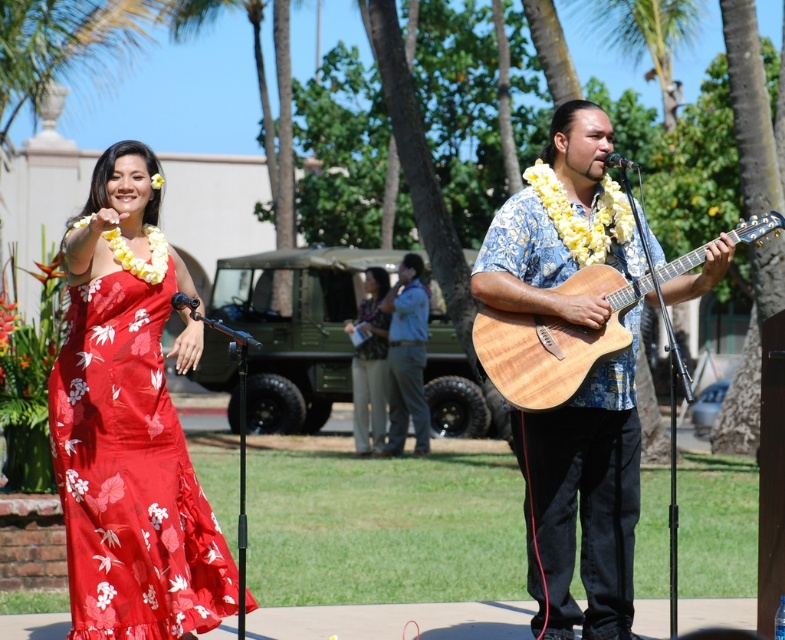
You are a photographer setting up for a tropical performance shoot. You have a camera with a 30 cm wide lens. You need to capture both the wooden acoustic guitar at center and the blue denim shirt at center in a single shot. Which object should you position closer to the lens to ensure both fit within the frame?

Since the wooden acoustic guitar at center is wider than the blue denim shirt at center, you should position the guitar closer to the lens. This will make the guitar appear larger in the frame, allowing both objects to fit within the 30 cm lens width.

You are a photographer at this tropical performance scene. You want to take a photo that includes both the wooden acoustic guitar at center and the blue denim shirt at center. If you need to ensure that the guitar is not completely blocked by the shirt, will the guitar fit in the frame without being obscured?

The wooden acoustic guitar at center is smaller than the blue denim shirt at center. Since the guitar is smaller, it may still be partially visible even if positioned behind the shirt, but there is a risk of obstruction depending on their exact positions. To ensure the guitar isn